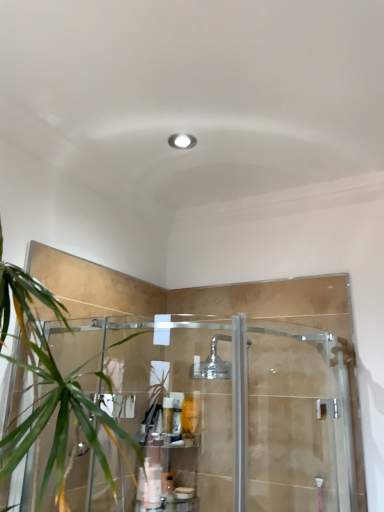
Question: Are clear plastic shelf at lower center and white matte bottle at lower center, the second toiletry ordered from the bottom, located far from each other?

Choices:
 (A) no
 (B) yes

Answer: (A)

Question: Does clear plastic shelf at lower center have a lesser height compared to white matte bottle at lower center, the second toiletry ordered from the bottom?

Choices:
 (A) yes
 (B) no

Answer: (B)

Question: Does clear plastic shelf at lower center turn towards white matte bottle at lower center, which is the 2th toiletry in top-to-bottom order?

Choices:
 (A) yes
 (B) no

Answer: (A)

Question: From a real-world perspective, is clear plastic shelf at lower center below white matte bottle at lower center, the second toiletry ordered from the bottom?

Choices:
 (A) no
 (B) yes

Answer: (A)

Question: From a real-world perspective, does clear plastic shelf at lower center stand above white matte bottle at lower center, which is the 2th toiletry in top-to-bottom order?

Choices:
 (A) no
 (B) yes

Answer: (B)

Question: Looking at the image, does translucent plastic bottle at lower center, which ranks as the 3th toiletry in top-to-bottom order, seem bigger or smaller compared to clear plastic shelf at lower center?

Choices:
 (A) small
 (B) big

Answer: (A)

Question: Would you say translucent plastic bottle at lower center, positioned as the 1th toiletry in bottom-to-top order, is inside or outside clear plastic shelf at lower center?

Choices:
 (A) inside
 (B) outside

Answer: (A)

Question: In terms of width, does translucent plastic bottle at lower center, which ranks as the 3th toiletry in top-to-bottom order, look wider or thinner when compared to clear plastic shelf at lower center?

Choices:
 (A) thin
 (B) wide

Answer: (A)

Question: From the image's perspective, is translucent plastic bottle at lower center, which ranks as the 3th toiletry in top-to-bottom order, above or below clear plastic shelf at lower center?

Choices:
 (A) below
 (B) above

Answer: (A)

Question: From the image's perspective, is clear plastic shelf at lower center positioned above or below translucent plastic bottle at center, the 3th toiletry in the bottom-to-top sequence?

Choices:
 (A) below
 (B) above

Answer: (A)

Question: Is point (193, 436) positioned closer to the camera than point (163, 415)?

Choices:
 (A) closer
 (B) farther

Answer: (B)

Question: Is clear plastic shelf at lower center wider or thinner than translucent plastic bottle at center, the 3th toiletry in the bottom-to-top sequence?

Choices:
 (A) thin
 (B) wide

Answer: (B)

Question: Is clear plastic shelf at lower center in front of or behind translucent plastic bottle at center, arranged as the 1th toiletry when viewed from the top, in the image?

Choices:
 (A) front
 (B) behind

Answer: (A)

Question: Considering the positions of point (168, 409) and point (215, 365), is point (168, 409) closer or farther from the camera than point (215, 365)?

Choices:
 (A) farther
 (B) closer

Answer: (B)

Question: Considering the positions of translucent plastic bottle at center, the 3th toiletry in the bottom-to-top sequence, and polished chrome shower head at center in the image, is translucent plastic bottle at center, the 3th toiletry in the bottom-to-top sequence, wider or thinner than polished chrome shower head at center?

Choices:
 (A) wide
 (B) thin

Answer: (B)